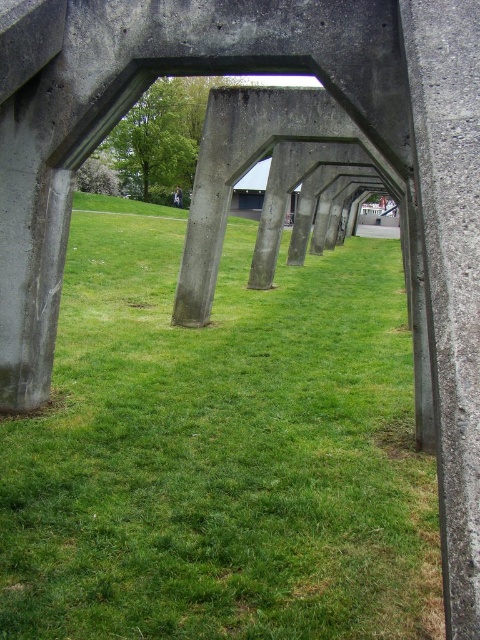
Question: Can you confirm if green grassy at center is positioned above concrete at center?

Choices:
 (A) yes
 (B) no

Answer: (B)

Question: Is the position of green grassy at center more distant than that of concrete at center?

Choices:
 (A) no
 (B) yes

Answer: (A)

Question: Is green grassy at center thinner than concrete at center?

Choices:
 (A) no
 (B) yes

Answer: (A)